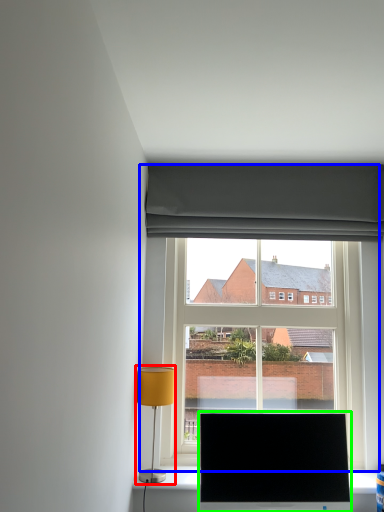
Question: Considering the real-world distances, which object is closest to table lamp (highlighted by a red box)? window (highlighted by a blue box) or television (highlighted by a green box).

Choices:
 (A) window
 (B) television

Answer: (B)